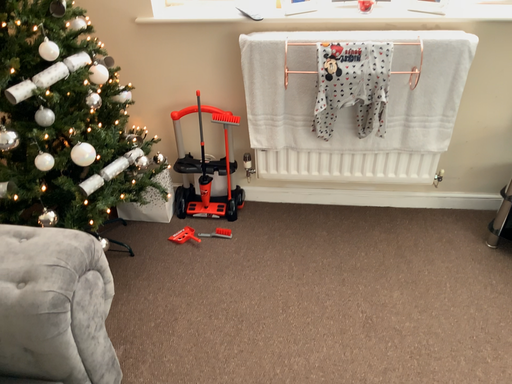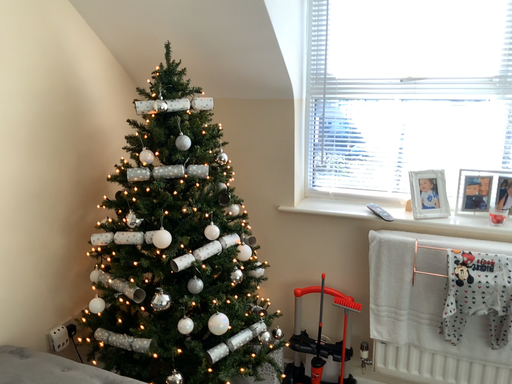
Question: How did the camera likely rotate when shooting the video?

Choices:
 (A) rotated upward
 (B) rotated downward

Answer: (A)